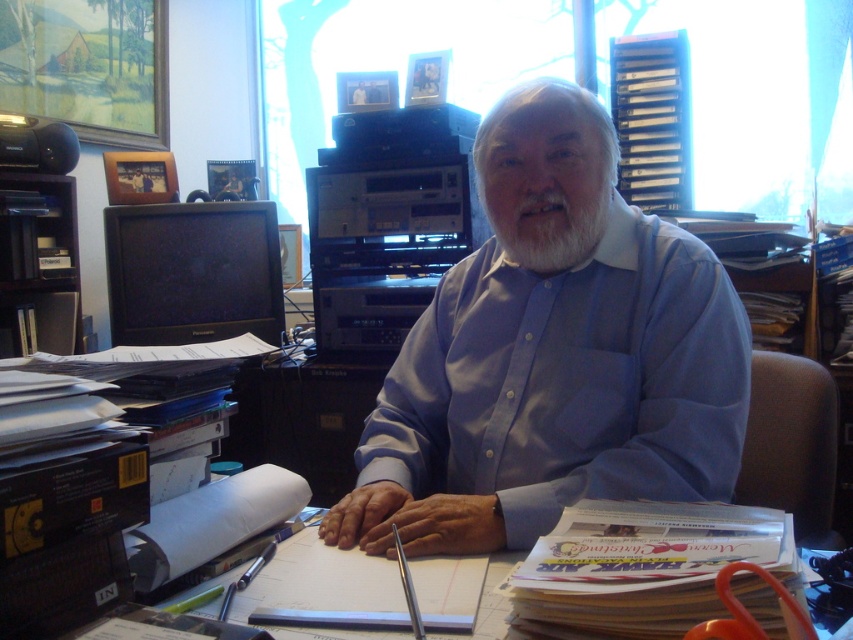
You are a tailor measuring a man for a custom suit. You need to determine if there is enough space between the blue smooth shirt at center and the white soft beard at center to insert a 15 centimeter long measuring tape. Can you fit it between them?

The blue smooth shirt at center is 16.83 centimeters away from the white soft beard at center. Since the measuring tape is 15 centimeters long, it can fit between them as the distance is greater than the tape length.

You are a tailor measuring the man for a new outfit. Which object, the blue smooth shirt at center or the white soft beard at center, has a greater width when viewed from the front?

The blue smooth shirt at center has a greater width than the white soft beard at center since its width surpasses the beard.